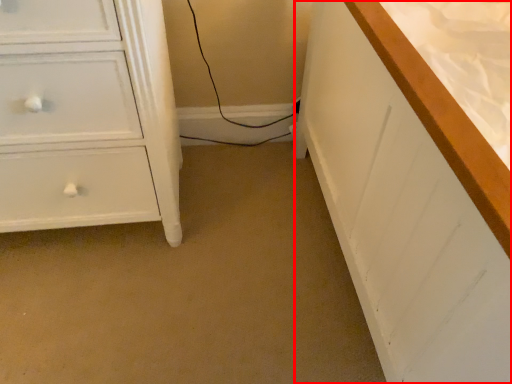
Question: Where is counter top (annotated by the red box) located in relation to chest of drawers in the image?

Choices:
 (A) left
 (B) right

Answer: (B)